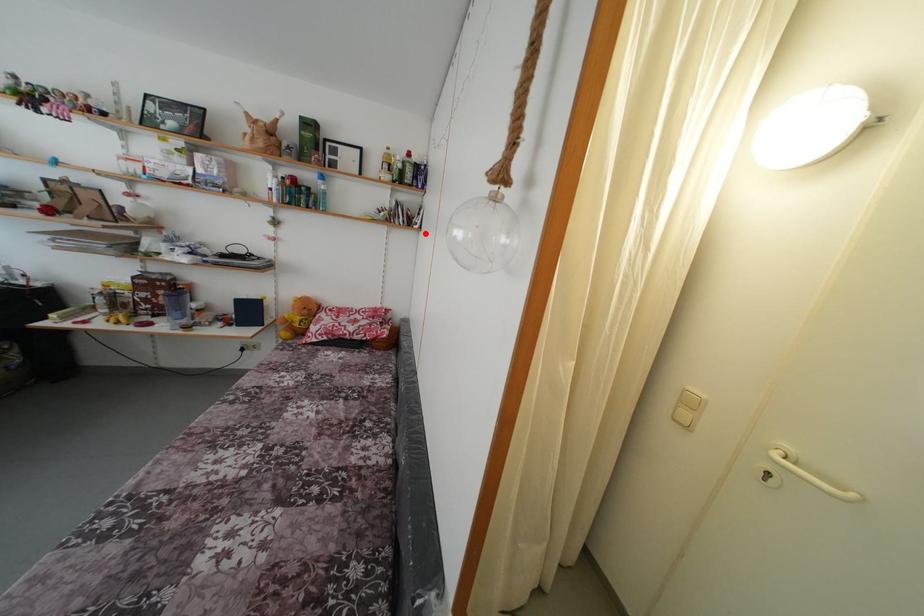
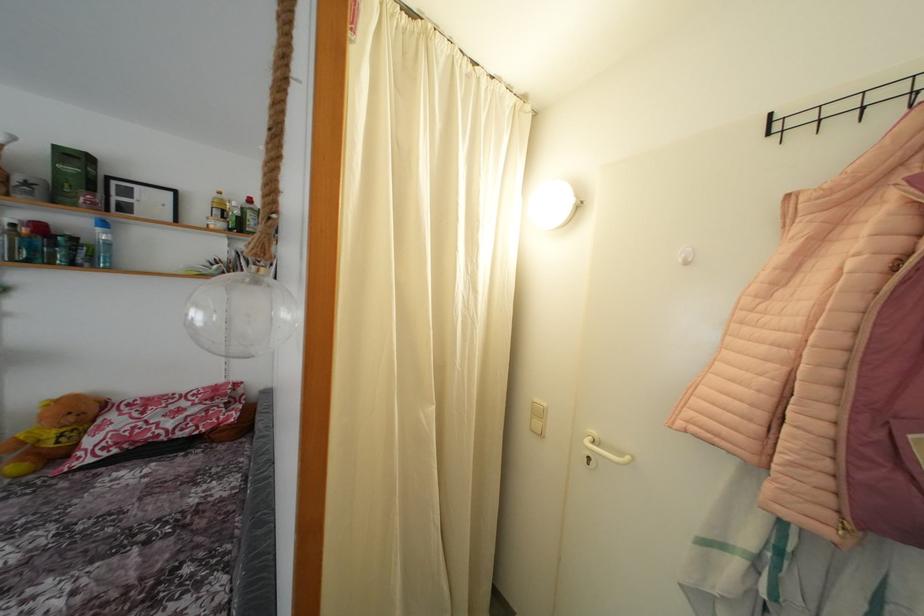
In the second image, find the point that corresponds to the highlighted location in the first image.

(281, 286)